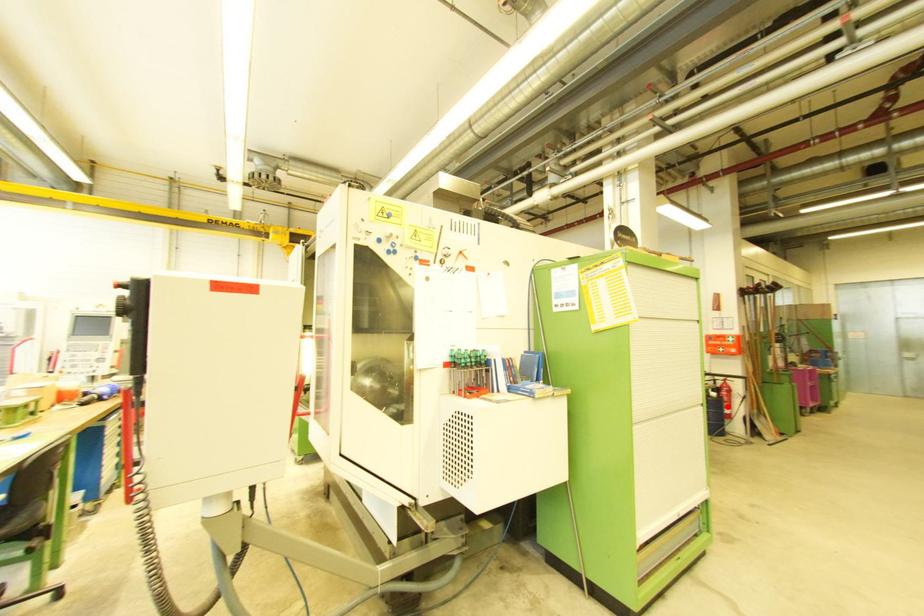
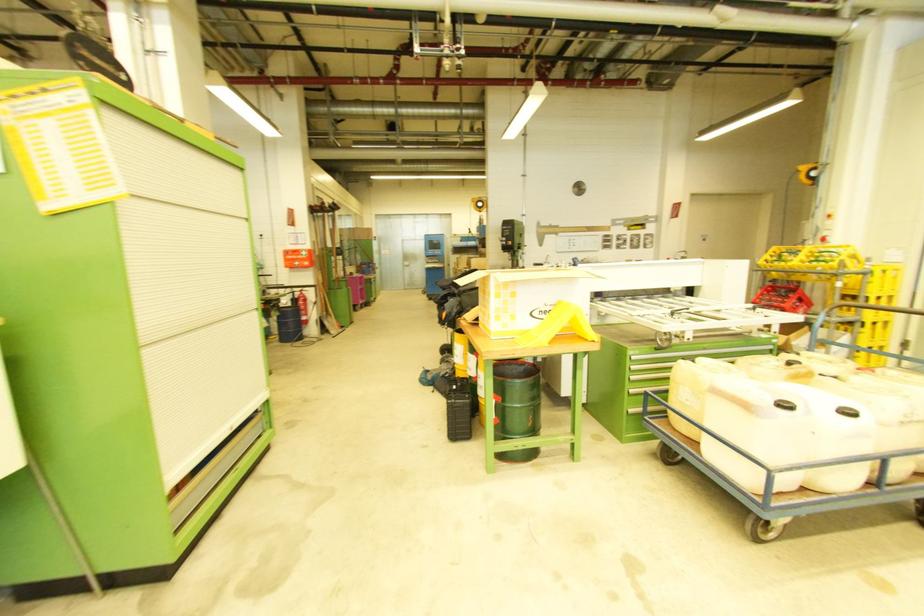
Question: I am providing you with two images of the same scene from different viewpoints. Image1 has a red point marked. In image2, the corresponding 3D location appears at what relative position? Reply with the corresponding letter.

Choices:
 (A) Closer
 (B) Farther

Answer: (A)